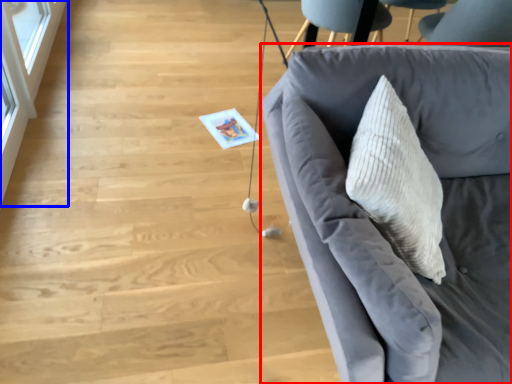
Question: Among these objects, which one is farthest to the camera, studio couch (highlighted by a red box) or glass door (highlighted by a blue box)?

Choices:
 (A) studio couch
 (B) glass door

Answer: (B)